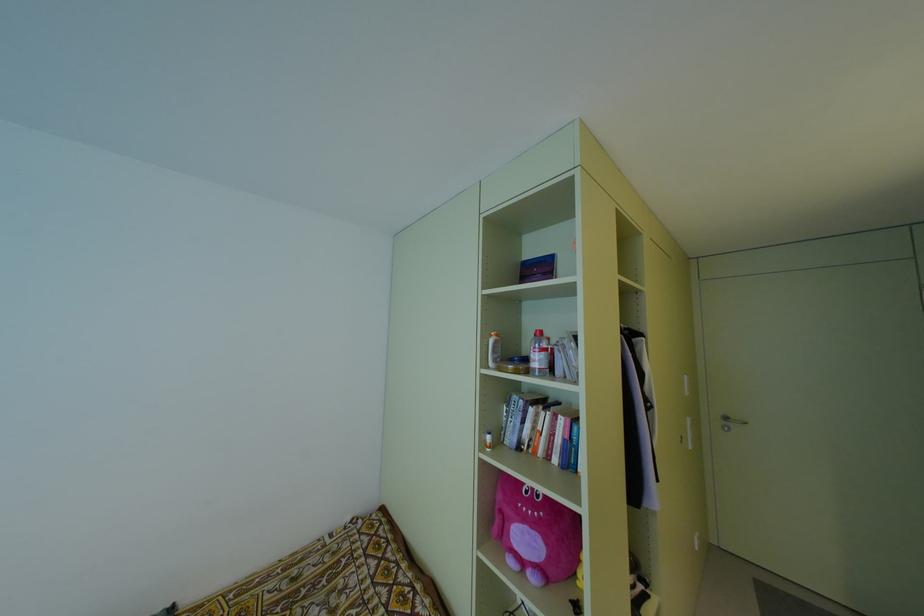
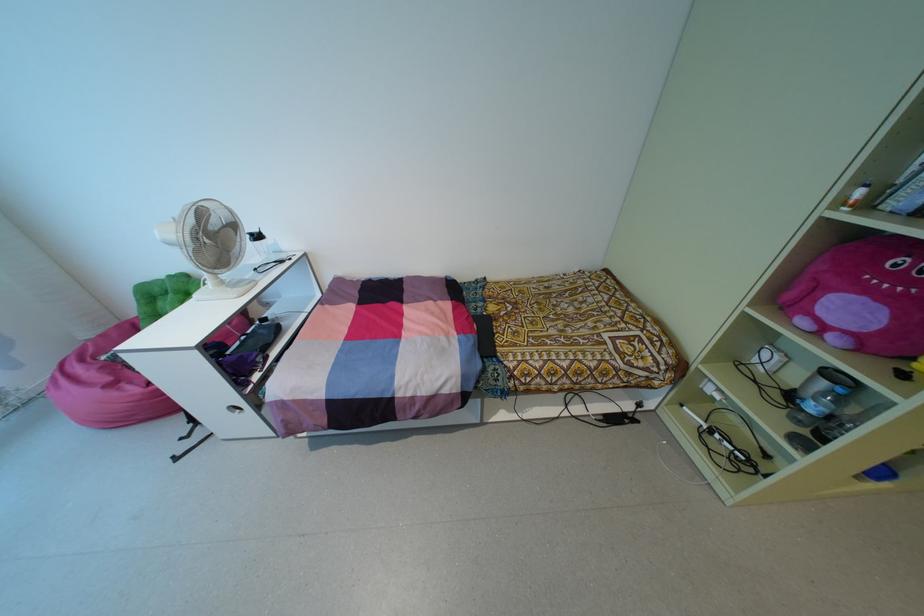
The images are taken continuously from a first-person perspective. In which direction is your viewpoint rotating?

The camera's rotation is toward left-down.